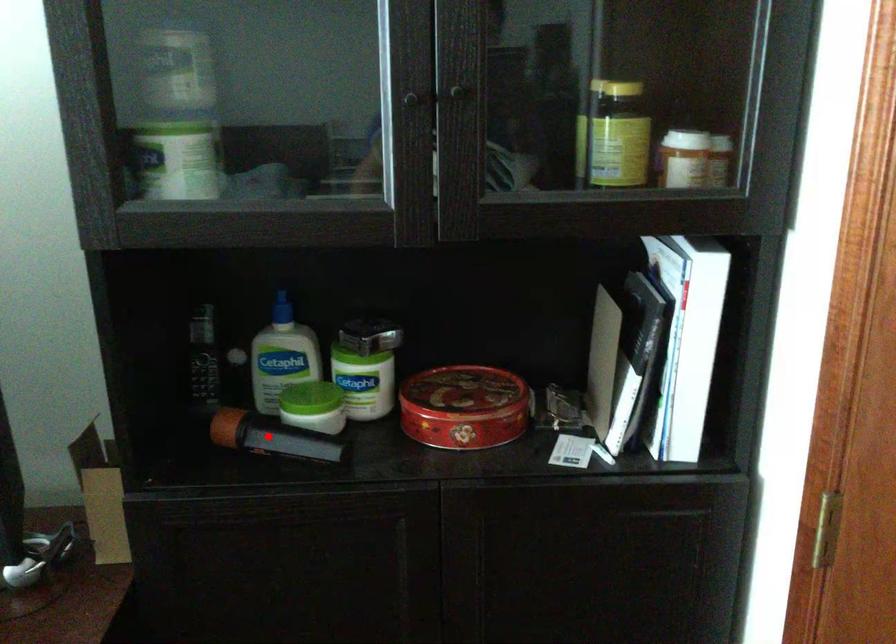
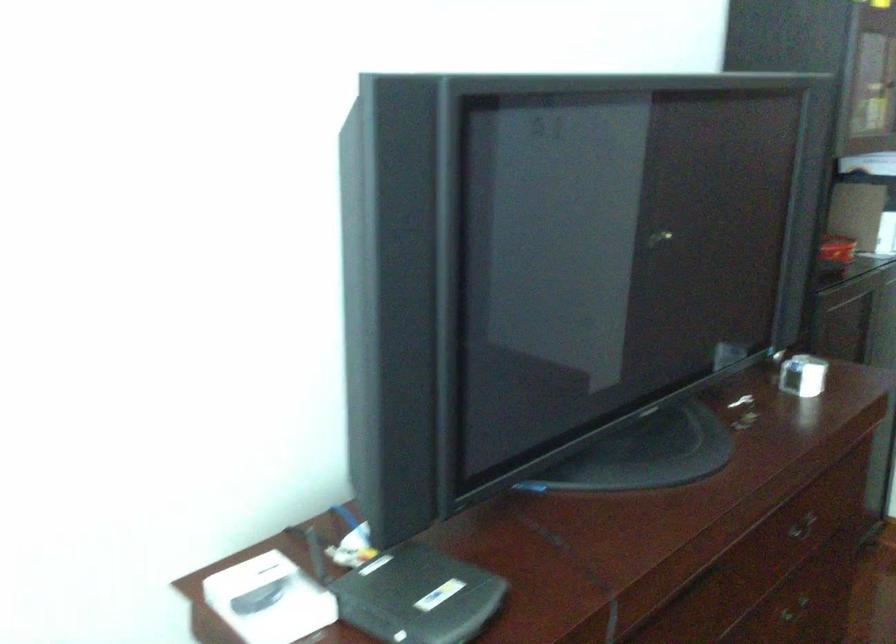
Question: I am providing you with two images of the same scene from different viewpoints. A red point is marked on the first image. Can you still see the location of the red point in image 2?

Choices:
 (A) Yes
 (B) No

Answer: (B)